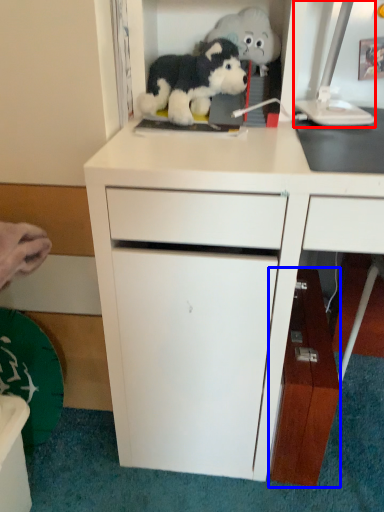
Question: Among these objects, which one is farthest to the camera, computer monitor (highlighted by a red box) or cabinetry (highlighted by a blue box)?

Choices:
 (A) computer monitor
 (B) cabinetry

Answer: (B)